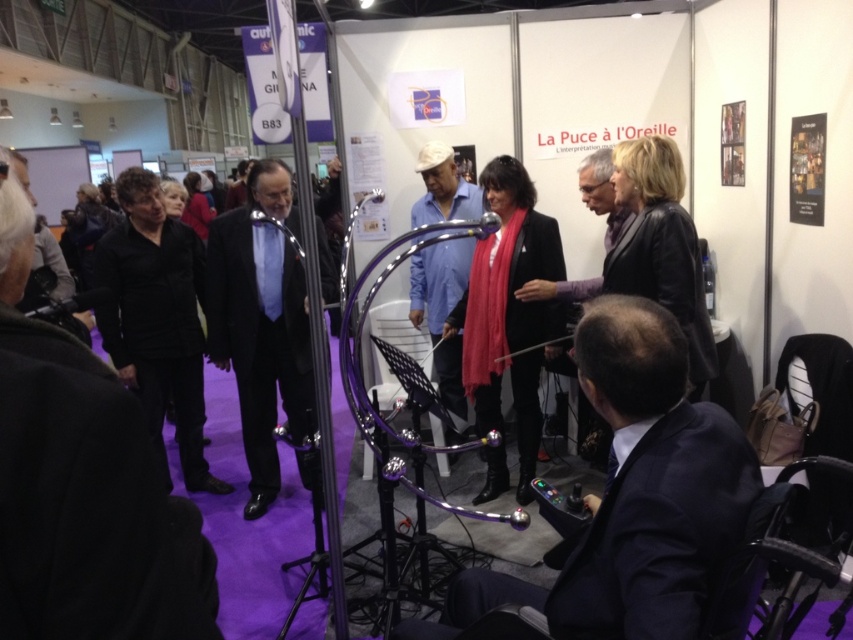
Question: Can you confirm if dark blue suit at lower right is wider than blue matte shirt at center?

Choices:
 (A) yes
 (B) no

Answer: (A)

Question: Which is farther from the dark blue suit at lower right?

Choices:
 (A) black leather jacket at upper left
 (B) black satin suit at center

Answer: (B)

Question: Does dark blue suit at lower right come behind blue matte shirt at center?

Choices:
 (A) yes
 (B) no

Answer: (B)

Question: Which of the following is the farthest from the observer?

Choices:
 (A) black leather jacket at upper left
 (B) black satin suit at center
 (C) blue matte shirt at center
 (D) dark blue suit at lower right

Answer: (C)

Question: Considering the real-world distances, which object is farthest from the black satin suit at center?

Choices:
 (A) dark blue suit at lower right
 (B) blue matte shirt at center
 (C) black leather jacket at upper left

Answer: (A)

Question: From the image, what is the correct spatial relationship of black leather jacket at upper left in relation to blue matte shirt at center?

Choices:
 (A) above
 (B) below

Answer: (B)